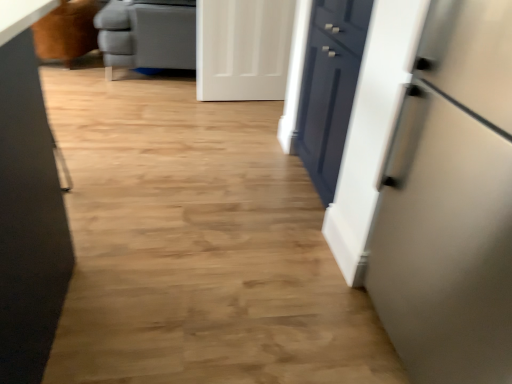
Question: Would you say gray leather ottoman at upper left is to the left or to the right of satin white refrigerator at right in the picture?

Choices:
 (A) left
 (B) right

Answer: (A)

Question: Considering the positions of gray leather ottoman at upper left and satin white refrigerator at right in the image, is gray leather ottoman at upper left wider or thinner than satin white refrigerator at right?

Choices:
 (A) thin
 (B) wide

Answer: (B)

Question: Which object is the farthest from the gray leather ottoman at upper left?

Choices:
 (A) brown leather armchair at upper left
 (B) satin white refrigerator at right
 (C) glossy dark blue drawer at center right
 (D) white matte door at upper center

Answer: (B)

Question: Considering the real-world distances, which object is farthest from the white matte door at upper center?

Choices:
 (A) glossy dark blue drawer at center right
 (B) brown leather armchair at upper left
 (C) satin white refrigerator at right
 (D) gray leather ottoman at upper left

Answer: (C)